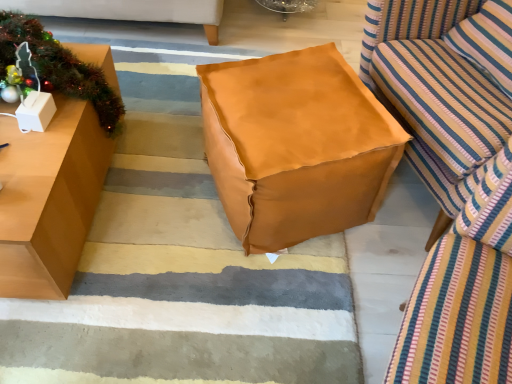
Identify the location of vacant space in between leather-like tan bean bag at center and matte brown table at left. (156, 204).